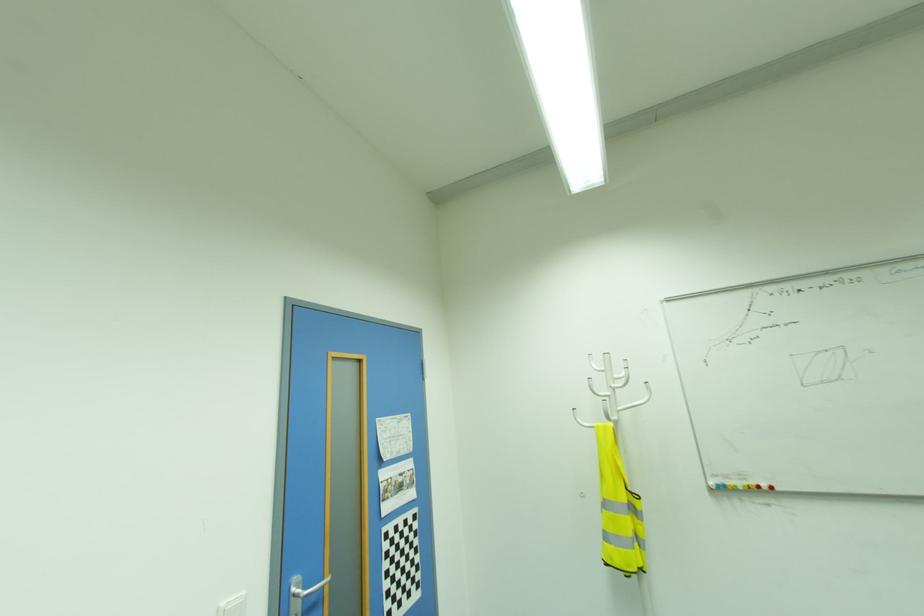
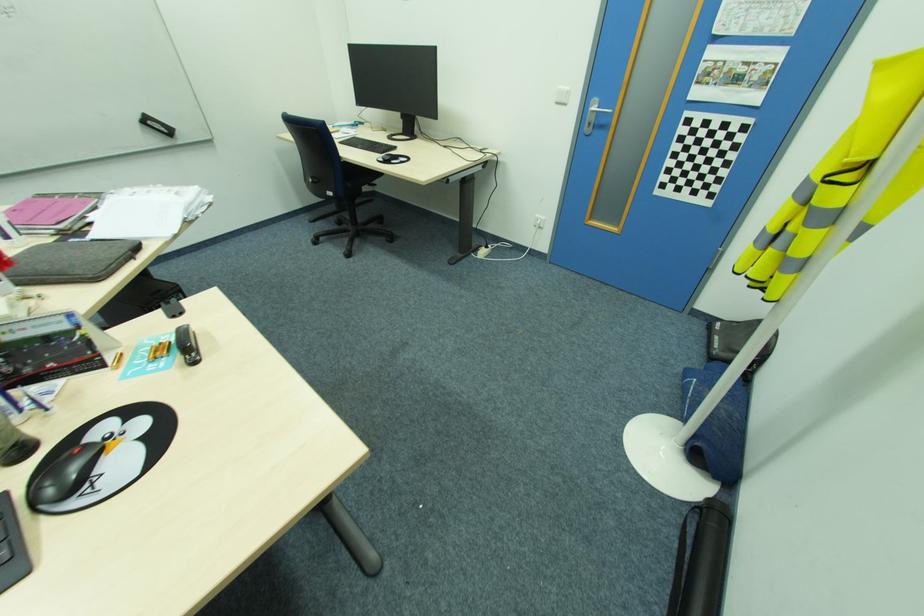
Locate, in the second image, the point that corresponds to the point at 308,586 in the first image.

(600, 108)